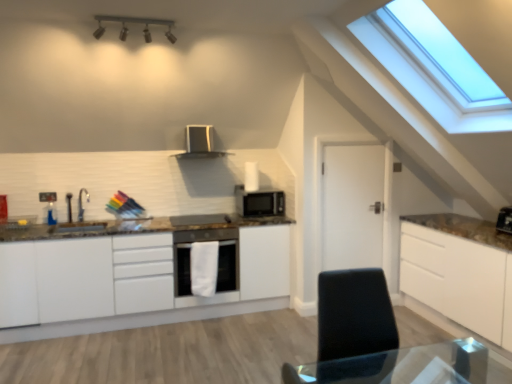
Locate an element on the screen. white glossy oven at center is located at coordinates (218, 263).

The image size is (512, 384). What do you see at coordinates (200, 143) in the screenshot?
I see `satin silver microwave at upper center` at bounding box center [200, 143].

The width and height of the screenshot is (512, 384). I want to click on metallic track lighting at upper center, so click(134, 23).

Describe the element at coordinates (200, 219) in the screenshot. The image size is (512, 384). I see `satin silver microwave at center` at that location.

Image resolution: width=512 pixels, height=384 pixels. Find the location of `white matte door at center`. white matte door at center is located at coordinates (353, 206).

The image size is (512, 384). Identify the location of white matte cabinet at center. (134, 280).

Is metallic track lighting at upper center inside white matte door at center?

No, white matte door at center does not contain metallic track lighting at upper center.

From a real-world perspective, who is located higher, white matte door at center or metallic track lighting at upper center?

metallic track lighting at upper center.

Image resolution: width=512 pixels, height=384 pixels. Identify the location of light fixture above the white matte door at center (from a real-world perspective). (134, 23).

Are white matte door at center and metallic track lighting at upper center far apart?

That's right, there is a large distance between white matte door at center and metallic track lighting at upper center.

Which object is wider, white glossy oven at center or satin silver microwave at center?

white glossy oven at center.

Is white glossy oven at center looking in the opposite direction of satin silver microwave at center?

white glossy oven at center does not have its back to satin silver microwave at center.

Is white glossy oven at center in contact with satin silver microwave at center?

They are not placed beside each other.

From the image's perspective, relative to metallic track lighting at upper center, is white glossy oven at center above or below?

Based on their image positions, white glossy oven at center is located beneath metallic track lighting at upper center.

Considering the sizes of white glossy oven at center and metallic track lighting at upper center in the image, is white glossy oven at center taller or shorter than metallic track lighting at upper center?

Considering their sizes, white glossy oven at center has more height than metallic track lighting at upper center.

Which object is closer to the camera, white glossy oven at center or metallic track lighting at upper center?

metallic track lighting at upper center.

Is metallic track lighting at upper center surrounded by white glossy oven at center?

That's incorrect, metallic track lighting at upper center is not inside white glossy oven at center.

At what (x,y) coordinates should I click in order to perform the action: click on cabinetry below the satin silver microwave at center (from the image's perspective). Please return your answer as a coordinate pair (x, y). The height and width of the screenshot is (384, 512). Looking at the image, I should click on (134, 280).

Which is more to the right, white matte cabinet at center or satin silver microwave at center?

satin silver microwave at center.

From the image's perspective, is white matte cabinet at center located above or below satin silver microwave at center?

Clearly, from the image's perspective, white matte cabinet at center is below satin silver microwave at center.

Does satin silver microwave at center turn towards satin black microwave at center?

No, satin silver microwave at center does not turn towards satin black microwave at center.

From the image's perspective, is satin silver microwave at center under satin black microwave at center?

Indeed, from the image's perspective, satin silver microwave at center is shown beneath satin black microwave at center.

From their relative heights in the image, would you say satin silver microwave at center is taller or shorter than satin black microwave at center?

In the image, satin silver microwave at center appears to be shorter than satin black microwave at center.

Which is more to the right, satin silver microwave at center or satin black microwave at center?

Positioned to the right is satin black microwave at center.

How distant is satin silver microwave at upper center from metallic track lighting at upper center?

satin silver microwave at upper center is 3.84 feet away from metallic track lighting at upper center.

Can we say satin silver microwave at upper center lies outside metallic track lighting at upper center?

Yes, satin silver microwave at upper center is not within metallic track lighting at upper center.

I want to click on light fixture on the left of satin silver microwave at upper center, so click(134, 23).

Considering the positions of objects white matte door at center and white matte cabinet at center in the image provided, who is more to the left, white matte door at center or white matte cabinet at center?

white matte cabinet at center.

Would you say white matte door at center is inside or outside white matte cabinet at center?

white matte door at center is located beyond the bounds of white matte cabinet at center.

Considering the sizes of white matte door at center and white matte cabinet at center in the image, is white matte door at center wider or thinner than white matte cabinet at center?

Clearly, white matte door at center has less width compared to white matte cabinet at center.

Looking at this image, is white matte door at center oriented towards white matte cabinet at center?

No, white matte door at center does not turn towards white matte cabinet at center.

Locate an element on the screen. The image size is (512, 384). door that appears behind the metallic track lighting at upper center is located at coordinates (353, 206).

Identify the location of home appliance located on the right of satin silver microwave at center. Image resolution: width=512 pixels, height=384 pixels. point(218,263).

From the image, which object appears to be nearer to white matte cabinet at center, satin silver microwave at upper center or white matte door at center?

white matte door at center.

From the image, which object appears to be farther from white matte cabinet at center, satin silver microwave at center or satin black microwave at center?

The object further to white matte cabinet at center is satin black microwave at center.

Based on their spatial positions, is metallic track lighting at upper center or satin black microwave at center further from satin silver microwave at upper center?

metallic track lighting at upper center is further to satin silver microwave at upper center.

When comparing their distances from satin silver microwave at upper center, does satin silver microwave at center or white glossy oven at center seem closer?

Based on the image, satin silver microwave at center appears to be nearer to satin silver microwave at upper center.

Considering their positions, is white matte door at center positioned closer to metallic track lighting at upper center than satin black microwave at center?

satin black microwave at center is positioned closer to the anchor metallic track lighting at upper center.

Estimate the real-world distances between objects in this image. Which object is closer to metallic track lighting at upper center, white matte cabinet at center or satin silver microwave at center?

Based on the image, satin silver microwave at center appears to be nearer to metallic track lighting at upper center.

When comparing their distances from white matte door at center, does satin silver microwave at upper center or white glossy oven at center seem further?

satin silver microwave at upper center lies further to white matte door at center than the other object.

Looking at the image, which one is located further to white matte door at center, satin silver microwave at center or satin black microwave at center?

Based on the image, satin silver microwave at center appears to be further to white matte door at center.

Identify the location of microwave oven between satin silver microwave at upper center and white glossy oven at center from top to bottom. This screenshot has height=384, width=512. (259, 203).

Locate an element on the screen. The height and width of the screenshot is (384, 512). appliance between metallic track lighting at upper center and white glossy oven at center in the vertical direction is located at coordinates (200, 219).

Find the location of a particular element. Image resolution: width=512 pixels, height=384 pixels. kitchen appliance between white matte cabinet at center and white matte door at center from left to right is located at coordinates (200, 143).

The height and width of the screenshot is (384, 512). What are the coordinates of `kitchen appliance that lies between metallic track lighting at upper center and white glossy oven at center from top to bottom` in the screenshot? It's located at (200, 143).